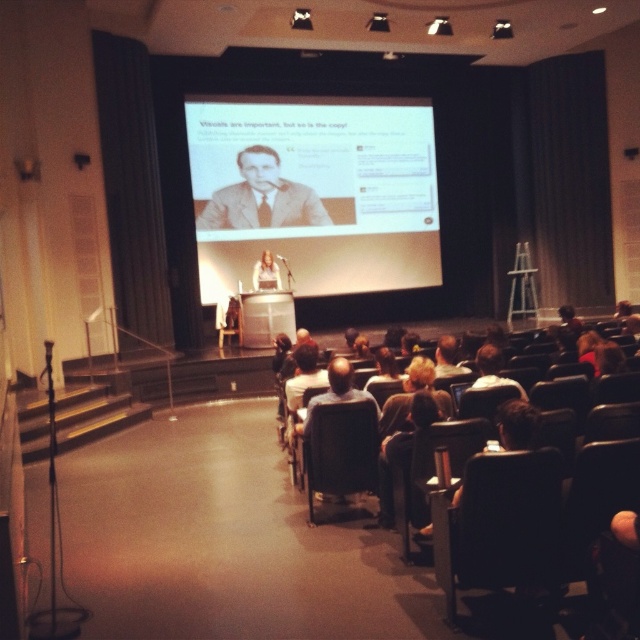
You are an event organizer who needs to seat VIP guests. You have two chairs available in the room. The black leather chair at lower right and the matte black chair at center. Which chair should you choose if you want to seat a guest who requires a more spacious seating option?

The black leather chair at lower right is larger in size than the matte black chair at center, so you should choose the black leather chair at lower right for the guest who requires a more spacious seating option.

You are an event organizer who needs to ensure that the speaker can easily reach their chair during the presentation. The speaker is wearing the matte beige suit at center. The black leather chair at center is where they will sit. Given the distance between them, is there enough space for the speaker to move comfortably from the podium to the chair without disturbing the audience?

The black leather chair at center and matte beige suit at center are 27.26 feet apart, providing ample space for the speaker to move comfortably from the podium to the chair without disturbing the audience.

You are sitting in the audience of the lecture hall and notice two points on the projection screen. The first point is labeled as point 1 at coordinates [536,500] and the second point is labeled as point 2 at coordinates [230,296]. Which point is closer to you?

Point 1 at coordinates [536,500] is closer to the viewer than point 2 at coordinates [230,296].